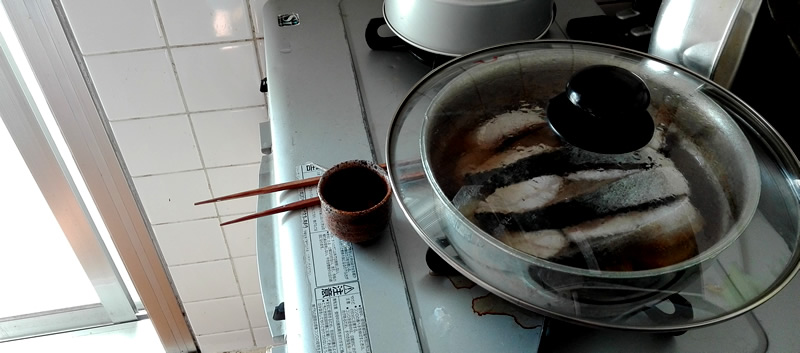
Where is `tile`? This screenshot has width=800, height=353. tile is located at coordinates (220, 303), (214, 273), (197, 248), (174, 193), (164, 151), (142, 61), (126, 23).